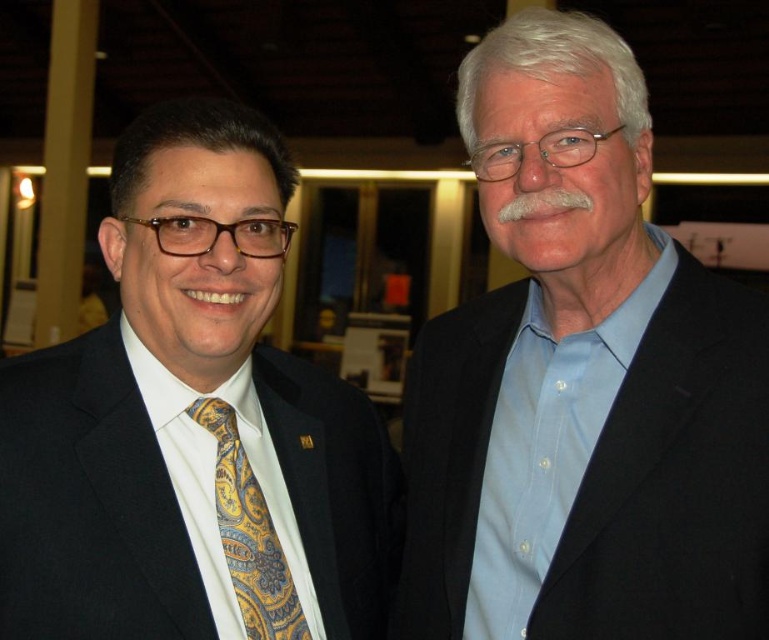
Between point (521, 326) and point (245, 492), which one is positioned in front?

Point (245, 492) is more forward.

Between point (430, 404) and point (281, 573), which one is positioned behind?

The point (430, 404) is behind.

Locate an element on the screen. The height and width of the screenshot is (640, 769). blue cotton shirt at right is located at coordinates (581, 381).

Which is below, matte black suit at left or yellow paisley silk tie at left?

yellow paisley silk tie at left is lower down.

Between matte black suit at left and yellow paisley silk tie at left, which one appears on the left side from the viewer's perspective?

From the viewer's perspective, matte black suit at left appears more on the left side.

Identify the location of matte black suit at left. The height and width of the screenshot is (640, 769). (187, 417).

Locate an element on the screen. matte black suit at left is located at coordinates (187, 417).

Can you confirm if blue cotton shirt at right is wider than matte black suit at left?

Yes, blue cotton shirt at right is wider than matte black suit at left.

Where is `blue cotton shirt at right`? blue cotton shirt at right is located at coordinates (581, 381).

Which is behind, point (678, 429) or point (188, 362)?

Point (188, 362)

The height and width of the screenshot is (640, 769). Find the location of `blue cotton shirt at right`. blue cotton shirt at right is located at coordinates (581, 381).